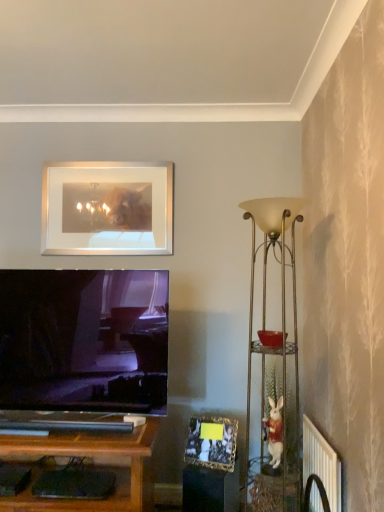
Question: Does gold metallic photo frame at lower center, the first picture frame viewed from the front, have a greater width compared to white plastic radiator at lower right?

Choices:
 (A) no
 (B) yes

Answer: (B)

Question: Is gold metallic photo frame at lower center, marked as the 2th picture frame in a back-to-front arrangement, outside white plastic radiator at lower right?

Choices:
 (A) yes
 (B) no

Answer: (A)

Question: Is gold metallic photo frame at lower center, acting as the 2th picture frame starting from the top, not close to white plastic radiator at lower right?

Choices:
 (A) no
 (B) yes

Answer: (A)

Question: Can you confirm if gold metallic photo frame at lower center, the first picture frame viewed from the front, is positioned to the right of white plastic radiator at lower right?

Choices:
 (A) no
 (B) yes

Answer: (A)

Question: From the image's perspective, would you say gold metallic photo frame at lower center, marked as the 2th picture frame in a back-to-front arrangement, is shown under white plastic radiator at lower right?

Choices:
 (A) no
 (B) yes

Answer: (A)

Question: Looking at their shapes, would you say silver/metallic picture frame at upper center, which appears as the 1th picture frame when viewed from the back, is wider or thinner than metallic gold floor lamp at right?

Choices:
 (A) wide
 (B) thin

Answer: (B)

Question: Based on their sizes in the image, would you say silver/metallic picture frame at upper center, which is the 2th picture frame from right to left, is bigger or smaller than metallic gold floor lamp at right?

Choices:
 (A) small
 (B) big

Answer: (A)

Question: From their relative heights in the image, would you say silver/metallic picture frame at upper center, the second picture frame positioned from the front, is taller or shorter than metallic gold floor lamp at right?

Choices:
 (A) tall
 (B) short

Answer: (B)

Question: Is silver/metallic picture frame at upper center, which is the 2th picture frame from right to left, to the left or to the right of metallic gold floor lamp at right in the image?

Choices:
 (A) left
 (B) right

Answer: (A)

Question: Based on their sizes in the image, would you say metallic gold floor lamp at right is bigger or smaller than white plastic radiator at lower right?

Choices:
 (A) small
 (B) big

Answer: (B)

Question: Choose the correct answer: Is metallic gold floor lamp at right inside white plastic radiator at lower right or outside it?

Choices:
 (A) inside
 (B) outside

Answer: (B)

Question: Is metallic gold floor lamp at right taller or shorter than white plastic radiator at lower right?

Choices:
 (A) short
 (B) tall

Answer: (B)

Question: Considering the positions of point (249, 311) and point (336, 465), is point (249, 311) closer or farther from the camera than point (336, 465)?

Choices:
 (A) closer
 (B) farther

Answer: (B)

Question: From the image's perspective, is white plastic radiator at lower right located above or below gold metallic photo frame at lower center, placed as the 2th picture frame when sorted from left to right?

Choices:
 (A) below
 (B) above

Answer: (A)

Question: In terms of size, does white plastic radiator at lower right appear bigger or smaller than gold metallic photo frame at lower center, marked as the 2th picture frame in a back-to-front arrangement?

Choices:
 (A) big
 (B) small

Answer: (A)